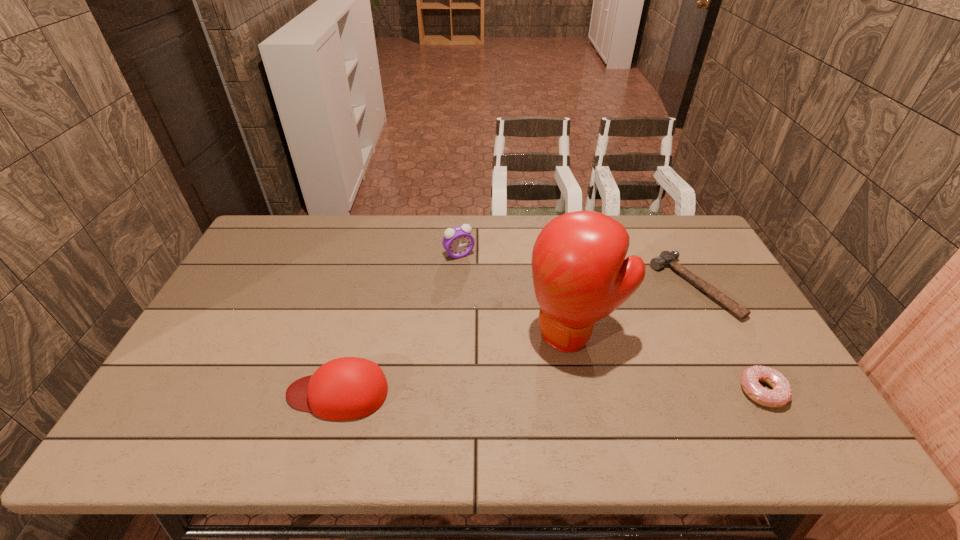
Identify the location of free space on the desktop that is between the baseball cap and the doughnut and is positioned on the face of the alarm clock. The height and width of the screenshot is (540, 960). (552, 392).

Locate an element on the screen. Image resolution: width=960 pixels, height=540 pixels. vacant space on the desktop that is between the leftmost object and the doughnut and is positioned on the striking face of the hammer is located at coordinates (489, 392).

Find the location of a particular element. The height and width of the screenshot is (540, 960). free space on the desktop that is between the leftmost object and the doughnut and is positioned on the striking surface of the boxing glove is located at coordinates (505, 392).